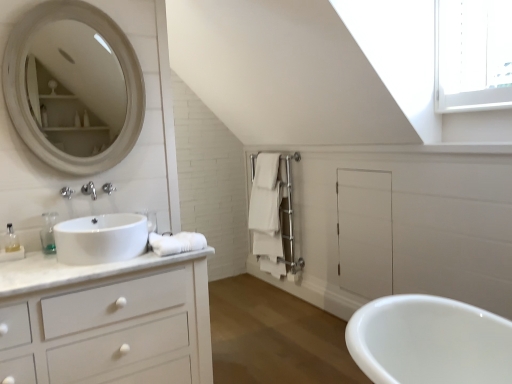
Question: From a real-world perspective, is white glossy sink at left physically located above or below white matte towel at center-right, which is counted as the 2th bath towel, starting from the front?

Choices:
 (A) above
 (B) below

Answer: (A)

Question: Considering the positions of white glossy sink at left and white matte towel at center-right, which is the 2th bath towel in bottom-to-top order, in the image, is white glossy sink at left wider or thinner than white matte towel at center-right, which is the 2th bath towel in bottom-to-top order,?

Choices:
 (A) thin
 (B) wide

Answer: (B)

Question: Considering the real-world distances, which object is farthest from the white glossy soap dispenser at left, which appears as the third toiletry when viewed from the left?

Choices:
 (A) translucent plastic soap dispenser at left, marked as the 3th toiletry in a right-to-left arrangement
 (B) translucent plastic bottle at left, the 2th toiletry in the back-to-front sequence
 (C) white glossy sink at left
 (D) white matte mirror at upper left
 (E) silver metallic faucet at left

Answer: (D)

Question: Which object is positioned farthest from the silver metallic faucet at left?

Choices:
 (A) white glossy sink at left
 (B) white glossy soap dispenser at left, arranged as the 3th toiletry when viewed from the front
 (C) translucent plastic soap dispenser at left, the first toiletry positioned from the left
 (D) white matte cabinet at left
 (E) white matte mirror at upper left

Answer: (E)